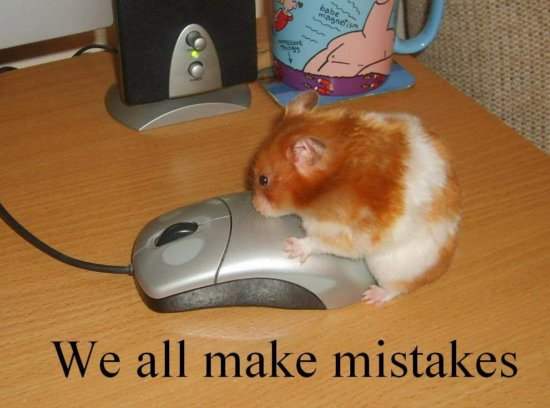
This screenshot has height=408, width=550. What are the coordinates of `mug` in the screenshot? It's located at (330, 20).